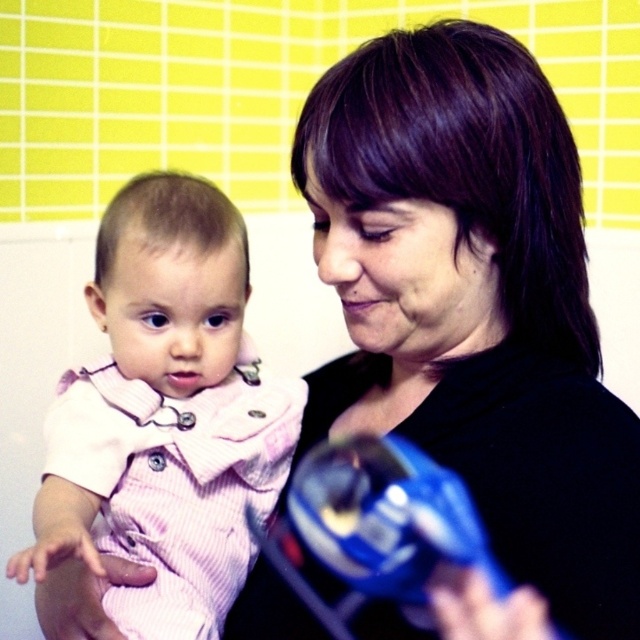
You are a photographer setting up a shoot. You have a black matte hair at center and a pink striped fabric at left in your scene. Based on the scene description, which object should you adjust to ensure proper framing? Please explain your reasoning.

The black matte hair at center might be wider than the pink striped fabric at left, so you should adjust the black matte hair at center to ensure it fits within the frame properly.

What are the coordinates of the black matte hair at center?

The black matte hair at center is located at coordinates point (474, 316).

You are a photographer trying to focus on the baby in the scene. You notice a point at coordinates (474,316). What object does this point correspond to?

The point at coordinates (474,316) corresponds to the black matte hair at center.